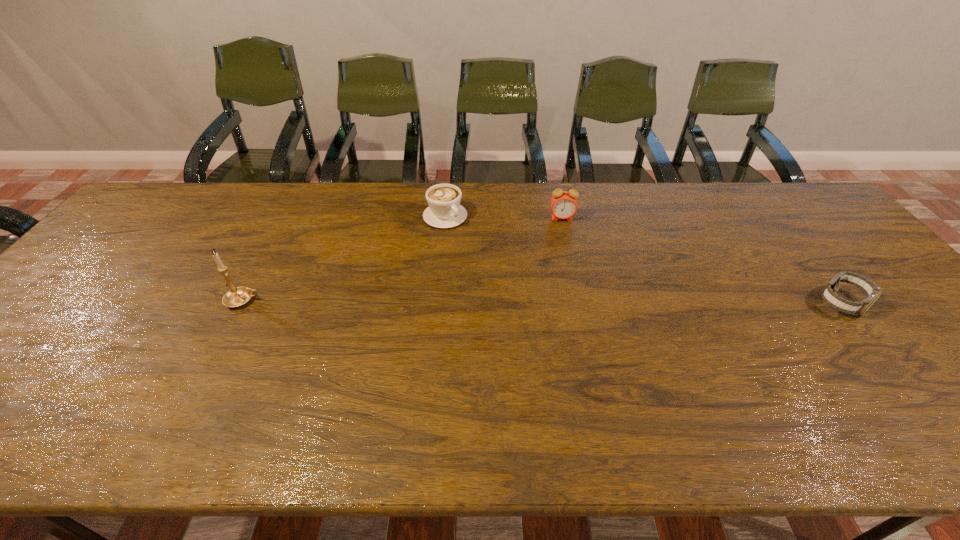
This screenshot has height=540, width=960. I want to click on free spot on the desktop that is between the tallest object and the rightmost object and is positioned on the face of the third object from left to right, so click(x=570, y=302).

Where is `vacant space on the desktop that is between the candle holder and the watch and is positioned to the right of the third object from right to left's handle`? vacant space on the desktop that is between the candle holder and the watch and is positioned to the right of the third object from right to left's handle is located at coordinates (542, 301).